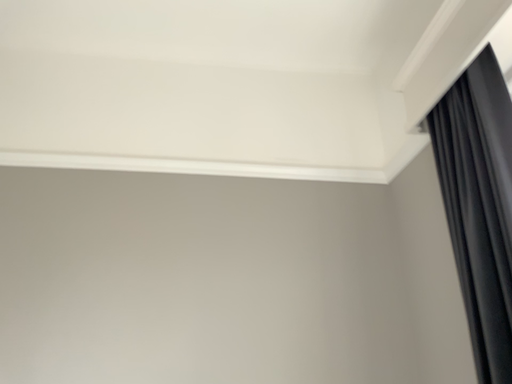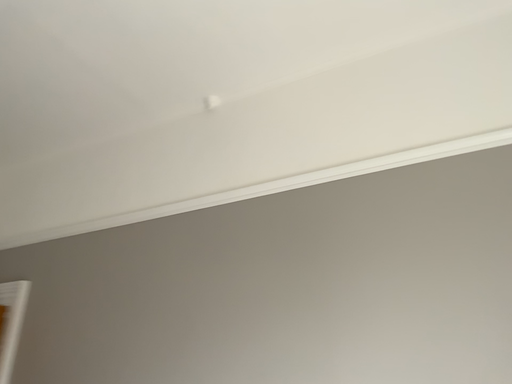
Question: How did the camera likely rotate when shooting the video?

Choices:
 (A) rotated left
 (B) rotated right

Answer: (A)